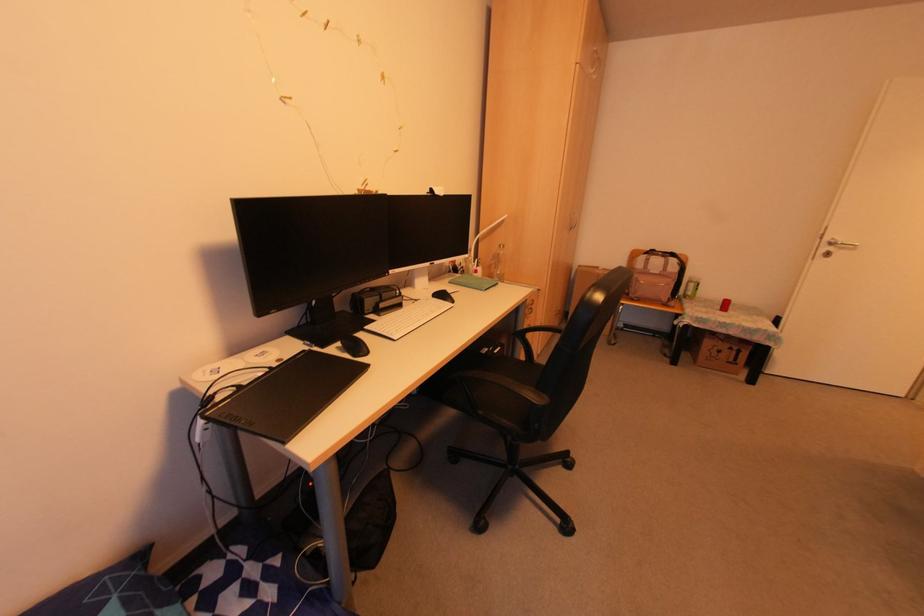
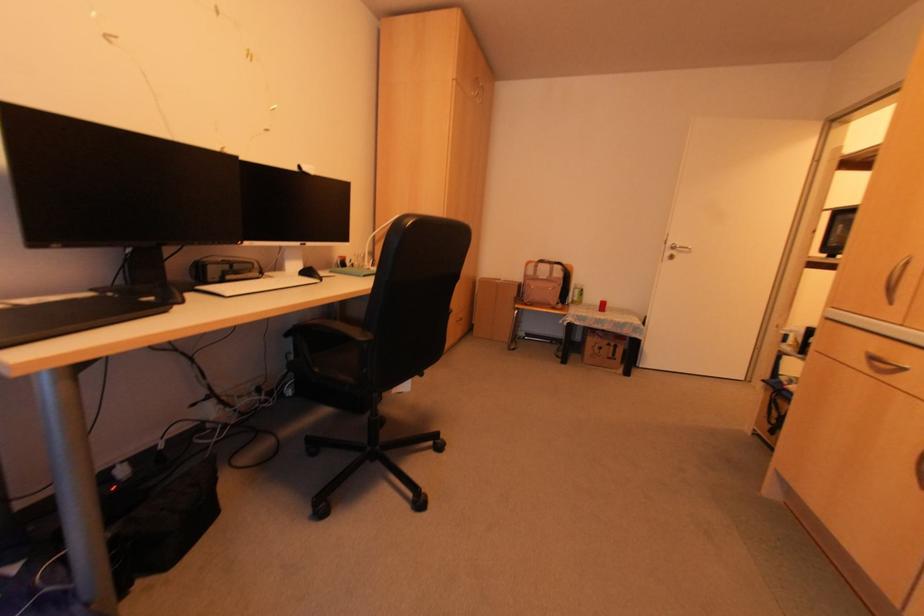
In the second image, find the point that corresponds to pixel 723 306 in the first image.

(601, 307)